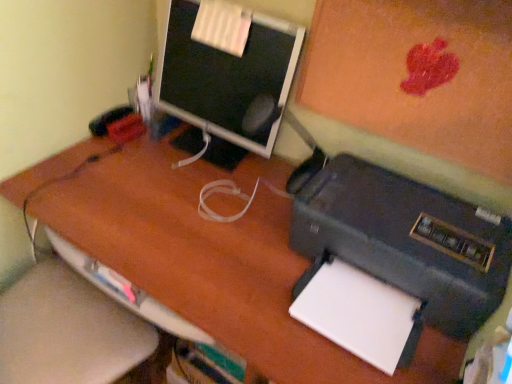
Question: From the image's perspective, relative to white paper at lower right, is black matte printer at lower right above or below?

Choices:
 (A) above
 (B) below

Answer: (A)

Question: Considering the positions of point (454, 233) and point (371, 306), is point (454, 233) closer or farther from the camera than point (371, 306)?

Choices:
 (A) farther
 (B) closer

Answer: (B)

Question: Based on their relative distances, which object is nearer to the black matte printer at lower right?

Choices:
 (A) matte black monitor at upper center
 (B) white paper at lower right
 (C) matte orange bulletin board at upper right

Answer: (B)

Question: Estimate the real-world distances between objects in this image. Which object is closer to the matte orange bulletin board at upper right?

Choices:
 (A) black matte printer at lower right
 (B) white paper at lower right
 (C) matte black monitor at upper center

Answer: (A)